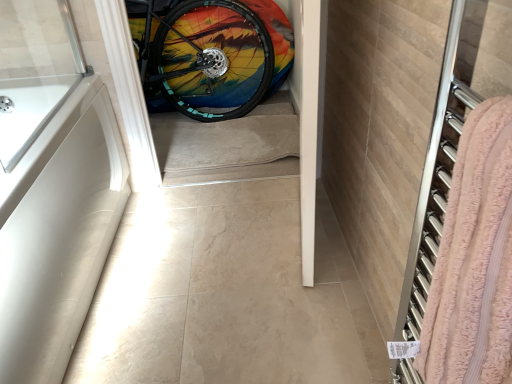
Question: Is white matte bathtub at left wider or thinner than rainbow painted tire at center?

Choices:
 (A) thin
 (B) wide

Answer: (B)

Question: Does point (10, 188) appear closer or farther from the camera than point (192, 79)?

Choices:
 (A) closer
 (B) farther

Answer: (A)

Question: Which is farther from the pink terry cloth towel at right?

Choices:
 (A) rainbow painted tire at center
 (B) white matte bathtub at left

Answer: (A)

Question: Which object is the closest to the rainbow painted tire at center?

Choices:
 (A) pink terry cloth towel at right
 (B) white matte bathtub at left

Answer: (B)